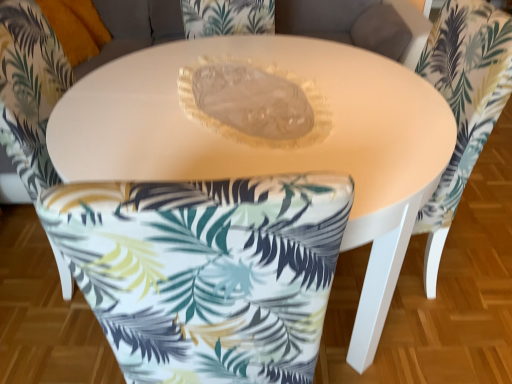
Question: In the image, is matte white table at center positioned in front of or behind white fabric chair at lower center, which appears as the first chair when viewed from the left?

Choices:
 (A) front
 (B) behind

Answer: (A)

Question: From a real-world perspective, is matte white table at center physically located above or below white fabric chair at lower center, which appears as the first chair when viewed from the left?

Choices:
 (A) below
 (B) above

Answer: (A)

Question: Considering the real-world distances, which object is closest to the matte white table at center?

Choices:
 (A) white fabric chair at center, which is the first chair in right-to-left order
 (B) white fabric chair at lower center, which is counted as the 2th chair, starting from the right

Answer: (A)

Question: Considering the real-world distances, which object is farthest from the matte white table at center?

Choices:
 (A) white fabric chair at lower center, which appears as the first chair when viewed from the left
 (B) white fabric chair at center, which is the first chair in right-to-left order

Answer: (A)